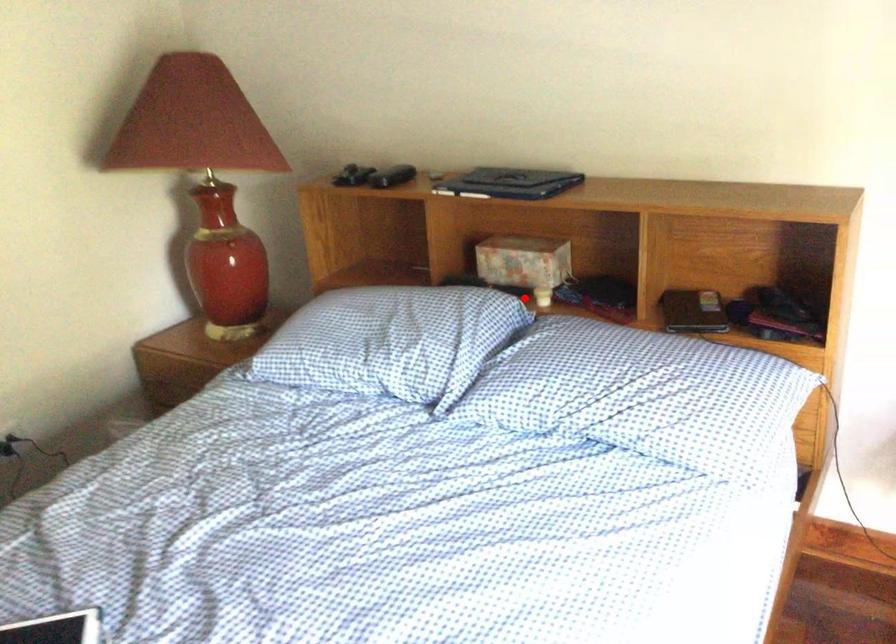
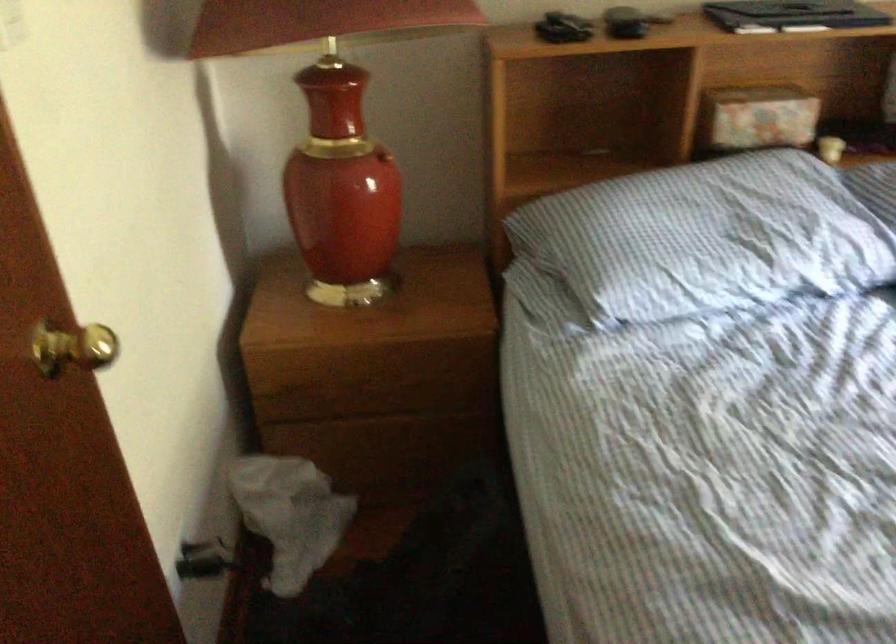
Question: I am providing you with two images of the same scene from different viewpoints. In image1, a red point is highlighted. Considering the same 3D point in image2, which of the following is correct?

Choices:
 (A) It is closer
 (B) It is farther

Answer: (A)